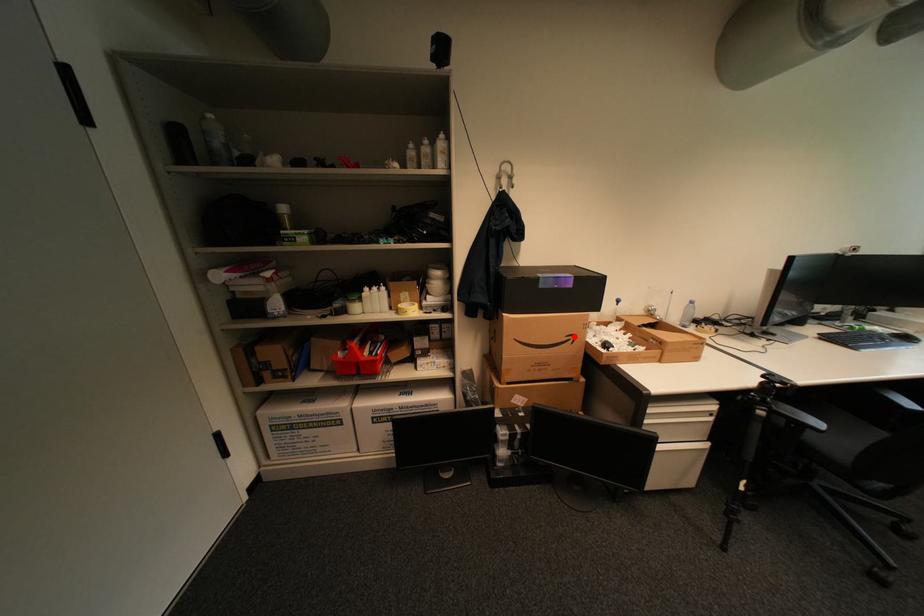
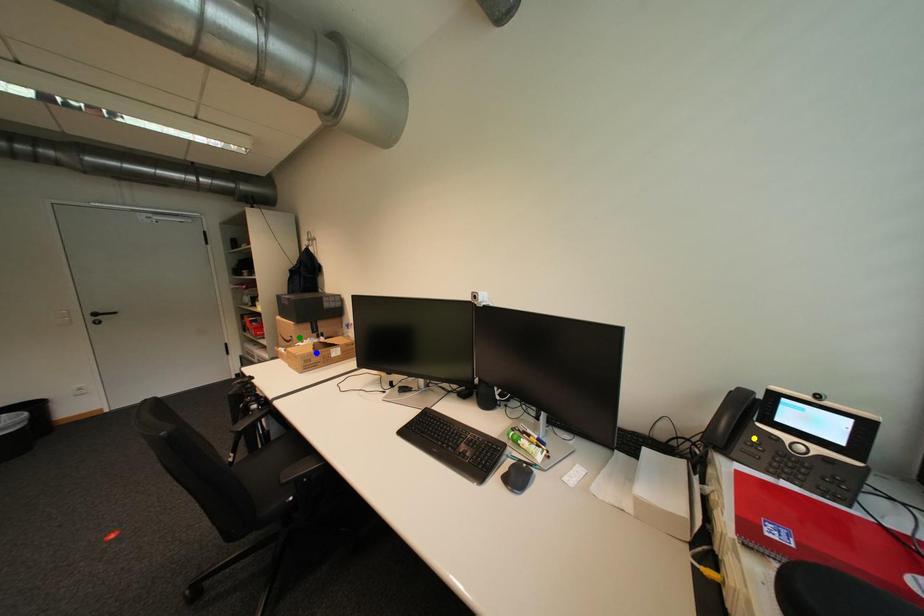
Question: I am providing you with two images of the same scene from different viewpoints. A red point is marked on the first image. You are given multiple points on the second image. Which point in image 2 is actually the same real-world point as the red point in image 1?

Choices:
 (A) blue point
 (B) green point
 (C) yellow point

Answer: (B)